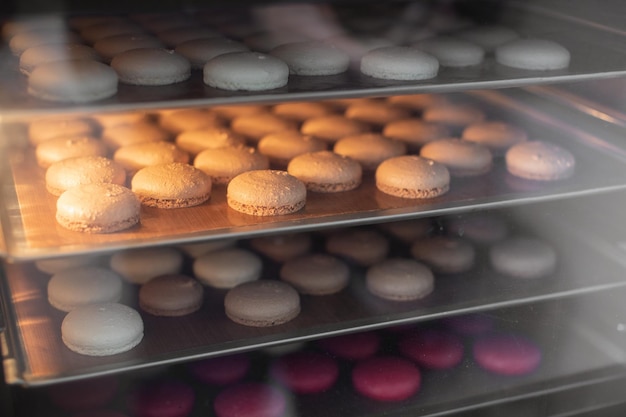
The height and width of the screenshot is (417, 626). I want to click on macaron shells on bottom shelf, so click(x=188, y=402), click(x=250, y=395), click(x=245, y=375), click(x=302, y=379), click(x=354, y=349), click(x=381, y=383), click(x=436, y=352), click(x=503, y=353), click(x=485, y=330).